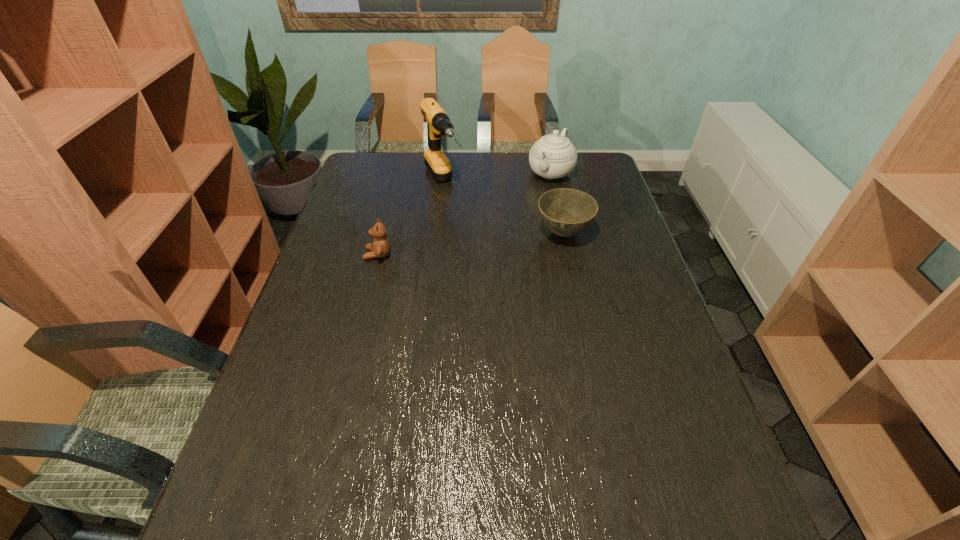
This screenshot has height=540, width=960. What are the coordinates of `vacant space on the desktop that is between the teddy bear and the bowl and is positioned at the tip of the drill` in the screenshot? It's located at (483, 242).

The width and height of the screenshot is (960, 540). Find the location of `free space on the desktop that is between the leftmost object and the bowl and is positioned on the spout of the chinaware`. free space on the desktop that is between the leftmost object and the bowl and is positioned on the spout of the chinaware is located at coordinates (496, 241).